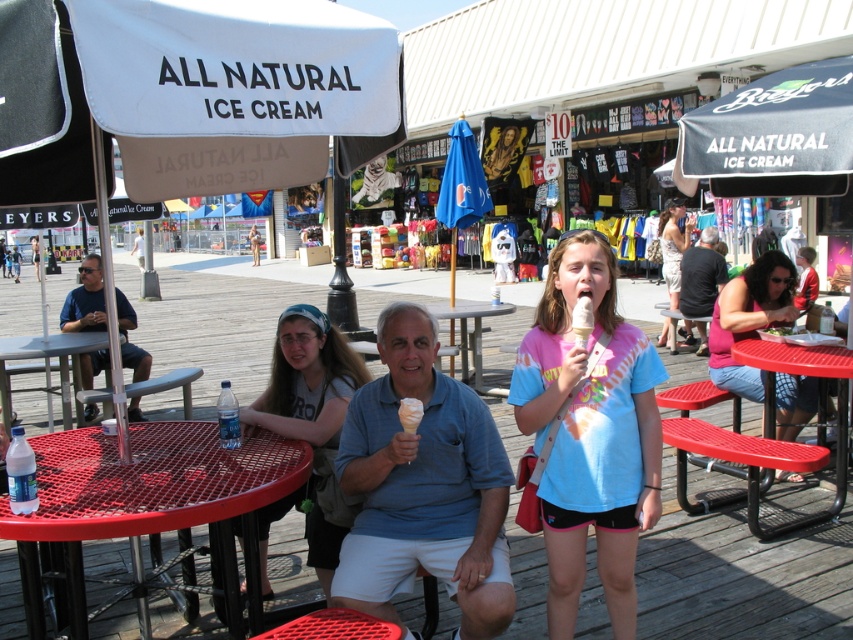
Does matte pink shirt at right have a greater width compared to white creamy ice cream cone at center?

Yes, matte pink shirt at right is wider than white creamy ice cream cone at center.

Does point (709, 344) come behind point (583, 298)?

That is True.

This screenshot has width=853, height=640. What are the coordinates of `matte pink shirt at right` in the screenshot? It's located at (749, 320).

The image size is (853, 640). Describe the element at coordinates (148, 500) in the screenshot. I see `red mesh table at lower left` at that location.

Identify the location of red mesh table at lower left. (148, 500).

This screenshot has height=640, width=853. I want to click on red mesh table at lower left, so click(x=148, y=500).

Based on the photo, is tie-dye fabric ice cream cone at center above matte pink shirt at right?

No.

Between point (589, 458) and point (795, 396), which one is positioned in front?

Point (589, 458) is in front.

Identify the location of tie-dye fabric ice cream cone at center. Image resolution: width=853 pixels, height=640 pixels. (590, 433).